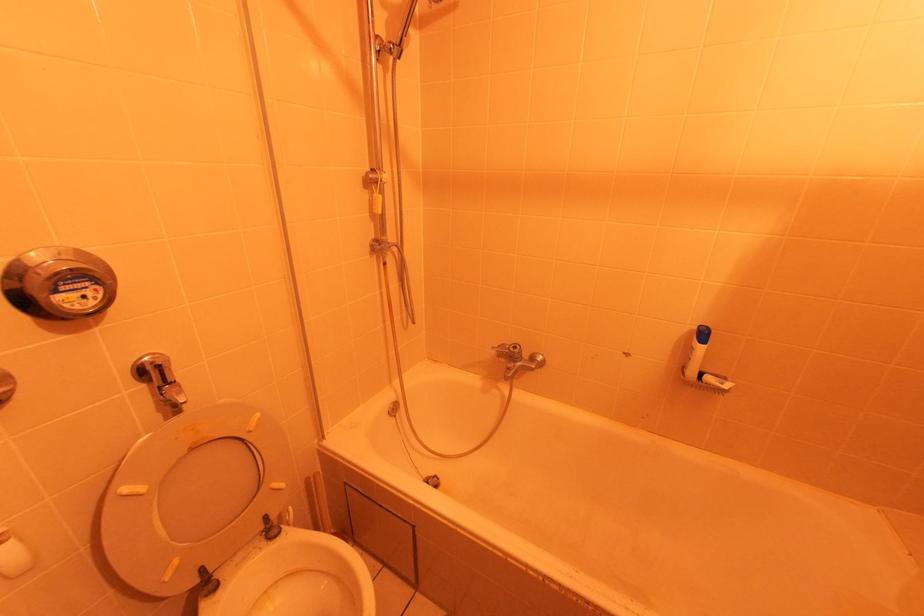
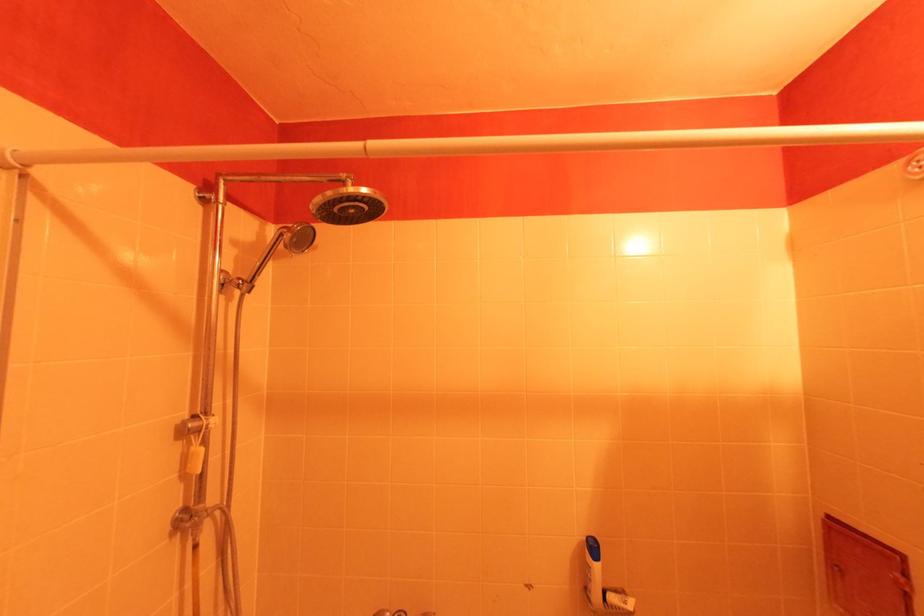
In the scene shown: Based on the continuous images, in which direction is the camera rotating?

The camera's rotation is toward right-up.